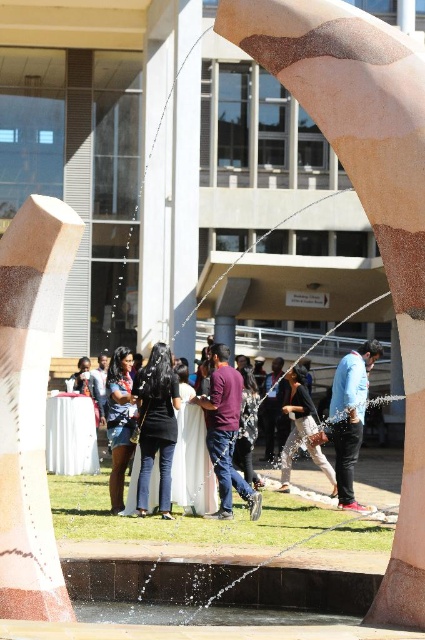
Measure the distance between maroon fabric shirt at center and blue denim jeans at center.

maroon fabric shirt at center is 4.36 meters away from blue denim jeans at center.

Does point (223, 364) lie in front of point (353, 493)?

Yes, point (223, 364) is closer to viewer.

Which is behind, point (209, 403) or point (367, 355)?

Point (367, 355)

The image size is (425, 640). Identify the location of maroon fabric shirt at center. (226, 433).

Consider the image. Which is above, maroon fabric shirt at center or matte black dress at center?

Positioned higher is maroon fabric shirt at center.

Is point (215, 465) positioned before point (303, 442)?

That is True.

Locate an element on the screen. Image resolution: width=425 pixels, height=640 pixels. maroon fabric shirt at center is located at coordinates (226, 433).

Which is in front, point (141, 477) or point (138, 451)?

Point (141, 477)

Where is `black matte pants at center`? Image resolution: width=425 pixels, height=640 pixels. black matte pants at center is located at coordinates (156, 426).

Where is `black matte pants at center`? black matte pants at center is located at coordinates (156, 426).